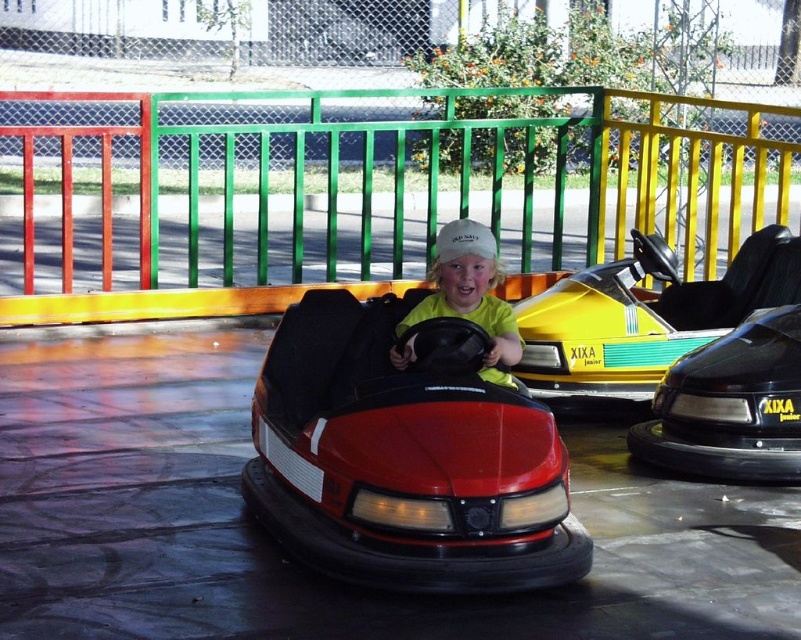
Question: Can you confirm if yellow matte bumper car at center is smaller than black glossy bumper car at right?

Choices:
 (A) yes
 (B) no

Answer: (B)

Question: Estimate the real-world distances between objects in this image. Which object is closer to the black glossy bumper car at right?

Choices:
 (A) shiny red bumper car at center
 (B) yellow matte bumper car at center

Answer: (B)

Question: Which point appears closest to the camera in this image?

Choices:
 (A) (703, 353)
 (B) (443, 536)
 (C) (526, 342)
 (D) (465, 260)

Answer: (B)

Question: Estimate the real-world distances between objects in this image. Which object is closer to the yellow matte shirt at center?

Choices:
 (A) black glossy bumper car at right
 (B) shiny red bumper car at center
 (C) yellow matte bumper car at center

Answer: (B)

Question: Can you confirm if shiny red bumper car at center is positioned above yellow matte bumper car at center?

Choices:
 (A) yes
 (B) no

Answer: (B)

Question: Can you confirm if black glossy bumper car at right is thinner than yellow matte shirt at center?

Choices:
 (A) no
 (B) yes

Answer: (A)